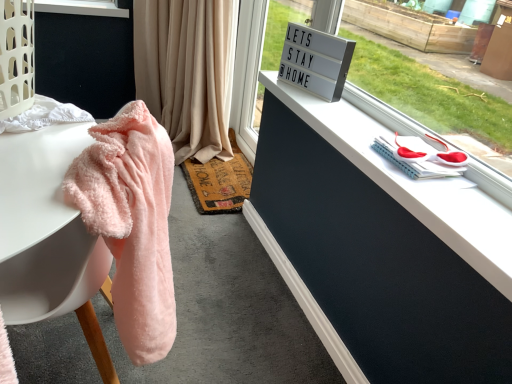
Find the location of a particular element. Image resolution: width=512 pixels, height=384 pixels. beige fabric curtain at upper center is located at coordinates (187, 71).

What is the approximate width of rustic woven mat at center?

It is 16.81 inches.

What do you see at coordinates (47, 234) in the screenshot?
I see `fluffy pink towel at left` at bounding box center [47, 234].

Where is `beige fabric curtain at upper center`? beige fabric curtain at upper center is located at coordinates (187, 71).

Locate an element on the screen. Image resolution: width=512 pixels, height=384 pixels. glass door behind the fluffy pink towel at left is located at coordinates (247, 72).

Is fluffy pink towel at left at the back of white plastic sign at upper center?

No.

Considering the sizes of objects white plastic sign at upper center and fluffy pink towel at left in the image provided, who is smaller, white plastic sign at upper center or fluffy pink towel at left?

white plastic sign at upper center.

Considering the sizes of objects white plastic sign at upper center and fluffy pink towel at left in the image provided, who is thinner, white plastic sign at upper center or fluffy pink towel at left?

With smaller width is white plastic sign at upper center.

From a real-world perspective, which object stands above the other?

fluffy pink towel at left, from a real-world perspective.

Is rustic woven mat at center directly adjacent to fluffy pink towel at left?

They are not placed beside each other.

From the image's perspective, would you say rustic woven mat at center is shown under fluffy pink towel at left?

No, from the image's perspective, rustic woven mat at center is not beneath fluffy pink towel at left.

The height and width of the screenshot is (384, 512). In the image, there is a rustic woven mat at center. Identify the location of desk below it (from the image's perspective). (47, 234).

Can you confirm if fluffy pink towel at left is smaller than white matte dresser at upper right?

A: Incorrect, fluffy pink towel at left is not smaller in size than white matte dresser at upper right.

Is fluffy pink towel at left not inside white matte dresser at upper right?

fluffy pink towel at left lies outside white matte dresser at upper right's area.

Considering the relative positions of fluffy pink towel at left and white matte dresser at upper right in the image provided, is fluffy pink towel at left in front of white matte dresser at upper right?

Yes, it is in front of white matte dresser at upper right.

Is fluffy pink towel at left with white matte dresser at upper right?

No, fluffy pink towel at left is not with white matte dresser at upper right.

Which point is more distant from viewer, (439, 375) or (244, 182)?

Positioned behind is point (244, 182).

From a real-world perspective, is white matte dresser at upper right over rustic woven mat at center?

Indeed, from a real-world perspective, white matte dresser at upper right stands above rustic woven mat at center.

Can you confirm if white matte dresser at upper right is taller than rustic woven mat at center?

Indeed, white matte dresser at upper right has a greater height compared to rustic woven mat at center.

Could you tell me if white matte dresser at upper right is turned towards rustic woven mat at center?

No, white matte dresser at upper right does not turn towards rustic woven mat at center.

What's the angular difference between beige fabric curtain at upper center and fluffy pink towel at left's facing directions?

They differ by 174 degrees in their facing directions.

Does beige fabric curtain at upper center appear on the left side of fluffy pink towel at left?

Correct, you'll find beige fabric curtain at upper center to the left of fluffy pink towel at left.

The width and height of the screenshot is (512, 384). Find the location of `curtain lying behind the fluffy pink towel at left`. curtain lying behind the fluffy pink towel at left is located at coordinates (187, 71).

From a real-world perspective, which object rests below the other?

From a 3D spatial view, fluffy pink towel at left is below.

Is rustic woven mat at center to the left or to the right of beige fabric curtain at upper center in the image?

Clearly, rustic woven mat at center is on the right of beige fabric curtain at upper center in the image.

Which is in front, point (219, 185) or point (200, 113)?

Point (219, 185)

Is the depth of rustic woven mat at center less than that of beige fabric curtain at upper center?

No, rustic woven mat at center is further to the viewer.

Considering the sizes of rustic woven mat at center and beige fabric curtain at upper center in the image, is rustic woven mat at center taller or shorter than beige fabric curtain at upper center?

rustic woven mat at center is shorter than beige fabric curtain at upper center.

Which of these two, white matte dresser at upper right or fluffy pink towel at left, is thinner?

white matte dresser at upper right is thinner.

Is white matte dresser at upper right positioned beyond the bounds of fluffy pink towel at left?

white matte dresser at upper right lies outside fluffy pink towel at left's area.

From a real-world perspective, which object rests below the other?

In real-world perspective, fluffy pink towel at left is lower.

Is white matte dresser at upper right next to fluffy pink towel at left?

white matte dresser at upper right and fluffy pink towel at left are clearly separated.

The height and width of the screenshot is (384, 512). What are the coordinates of `bath towel directly beneath the white plastic sign at upper center (from a real-world perspective)` in the screenshot? It's located at (132, 223).

This screenshot has height=384, width=512. Find the location of `desk in front of the rustic woven mat at center`. desk in front of the rustic woven mat at center is located at coordinates (47, 234).

When comparing their distances from white plastic sign at upper center, does fluffy pink towel at left or rustic woven mat at center seem closer?

rustic woven mat at center is closer to white plastic sign at upper center.

When comparing their distances from white plastic sign at upper center, does rustic woven mat at center or fluffy pink towel at left seem closer?

rustic woven mat at center lies closer to white plastic sign at upper center than the other object.

Based on their spatial positions, is rustic woven mat at center or white matte dresser at upper right further from beige fabric curtain at upper center?

white matte dresser at upper right is positioned further to the anchor beige fabric curtain at upper center.

Which object lies nearer to the anchor point fluffy pink towel at left, white matte dresser at upper right or rustic woven mat at center?

white matte dresser at upper right is positioned closer to the anchor fluffy pink towel at left.

When comparing their distances from white matte dresser at upper right, does fluffy pink towel at left or rustic woven mat at center seem further?

rustic woven mat at center.

Considering their positions, is fluffy pink towel at left positioned closer to rustic woven mat at center than beige fabric curtain at upper center?

Based on the image, beige fabric curtain at upper center appears to be nearer to rustic woven mat at center.

When comparing their distances from rustic woven mat at center, does white matte dresser at upper right or fluffy pink towel at left seem closer?

white matte dresser at upper right lies closer to rustic woven mat at center than the other object.

Looking at the image, which one is located further to rustic woven mat at center, fluffy pink towel at left or white matte dresser at upper right?

fluffy pink towel at left.

Locate an element on the screen. Image resolution: width=512 pixels, height=384 pixels. bath towel located between fluffy pink towel at left and beige fabric curtain at upper center in the depth direction is located at coordinates (132, 223).

Identify the location of dresser between fluffy pink towel at left and beige fabric curtain at upper center along the z-axis. Image resolution: width=512 pixels, height=384 pixels. (380, 249).

Locate an element on the screen. Image resolution: width=512 pixels, height=384 pixels. glass door between fluffy pink towel at left and beige fabric curtain at upper center from front to back is located at coordinates (247, 72).

At what (x,y) coordinates should I click in order to perform the action: click on bath towel between fluffy pink towel at left and white matte dresser at upper right from left to right. Please return your answer as a coordinate pair (x, y). Image resolution: width=512 pixels, height=384 pixels. Looking at the image, I should click on (132, 223).